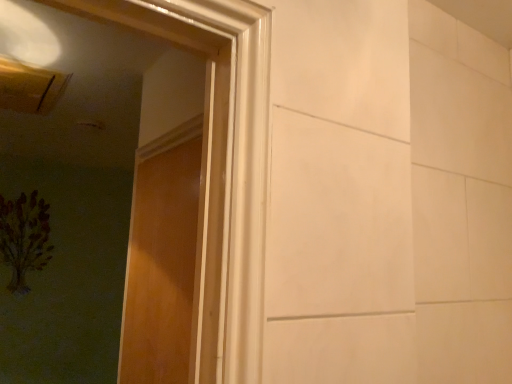
Question: Is brown textured painting at left behind wooden door at left?

Choices:
 (A) no
 (B) yes

Answer: (B)

Question: Is brown textured painting at left closer to the viewer compared to wooden door at left?

Choices:
 (A) no
 (B) yes

Answer: (A)

Question: From a real-world perspective, is brown textured painting at left under wooden door at left?

Choices:
 (A) yes
 (B) no

Answer: (B)

Question: Is brown textured painting at left smaller than wooden door at left?

Choices:
 (A) no
 (B) yes

Answer: (A)

Question: From the image's perspective, is brown textured painting at left located above wooden door at left?

Choices:
 (A) no
 (B) yes

Answer: (A)

Question: Does brown textured painting at left have a lesser height compared to wooden door at left?

Choices:
 (A) no
 (B) yes

Answer: (B)

Question: From the image's perspective, is wooden door at left over brown textured painting at left?

Choices:
 (A) yes
 (B) no

Answer: (A)

Question: From the image's perspective, does wooden door at left appear lower than brown textured painting at left?

Choices:
 (A) no
 (B) yes

Answer: (A)

Question: Can you confirm if wooden door at left is positioned to the left of brown textured painting at left?

Choices:
 (A) no
 (B) yes

Answer: (A)

Question: Is wooden door at left shorter than brown textured painting at left?

Choices:
 (A) yes
 (B) no

Answer: (B)

Question: Is brown textured painting at left at the back of wooden door at left?

Choices:
 (A) yes
 (B) no

Answer: (B)

Question: Is wooden door at left positioned far away from brown textured painting at left?

Choices:
 (A) no
 (B) yes

Answer: (B)

Question: Does point (141, 359) appear closer or farther from the camera than point (20, 228)?

Choices:
 (A) farther
 (B) closer

Answer: (B)